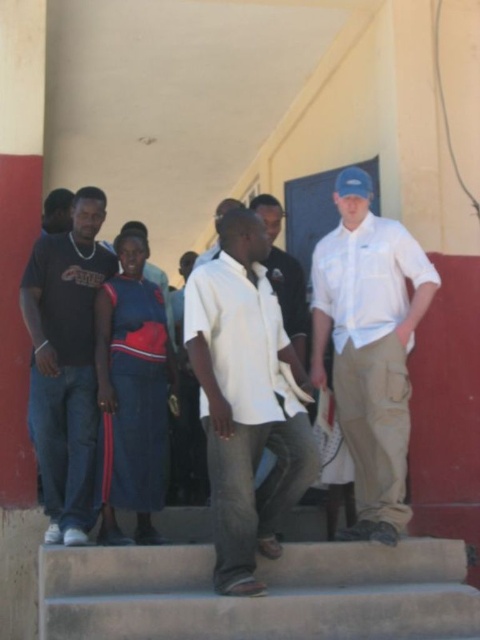
Question: Among these points, which one is nearest to the camera?

Choices:
 (A) (385, 627)
 (B) (239, 486)
 (C) (343, 396)
 (D) (33, 371)

Answer: (A)

Question: Among these objects, which one is farthest from the camera?

Choices:
 (A) dark blue jeans at center
 (B) white cotton shirt at center
 (C) matte khaki pants at right

Answer: (A)

Question: Can you confirm if white cotton shirt at center is thinner than matte khaki pants at right?

Choices:
 (A) yes
 (B) no

Answer: (A)

Question: Does concrete stairs at center appear over blue denim skirt at center?

Choices:
 (A) no
 (B) yes

Answer: (A)

Question: Does concrete stairs at center come in front of white cotton shirt at center?

Choices:
 (A) no
 (B) yes

Answer: (B)

Question: Which point is farther from the camera taking this photo?

Choices:
 (A) (279, 413)
 (B) (276, 563)

Answer: (A)